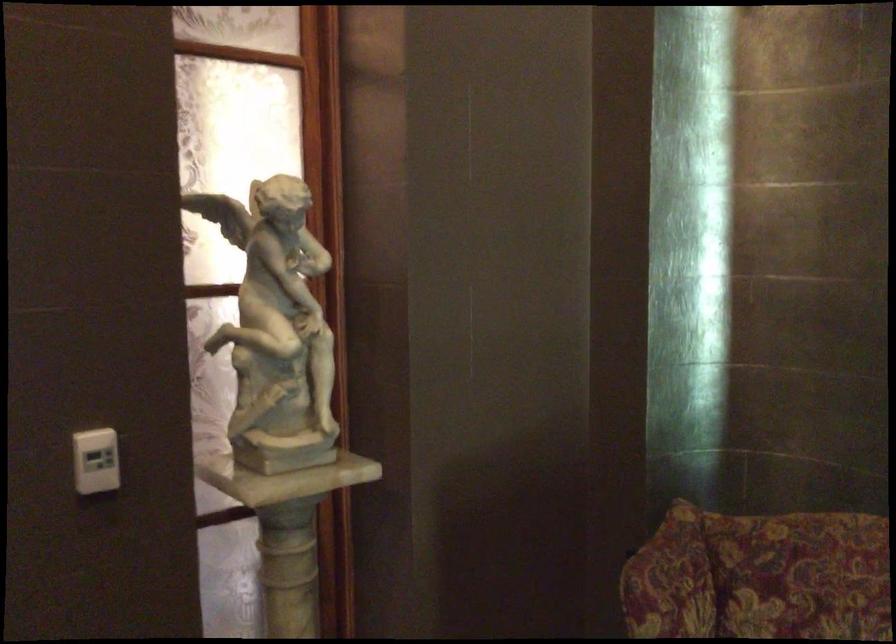
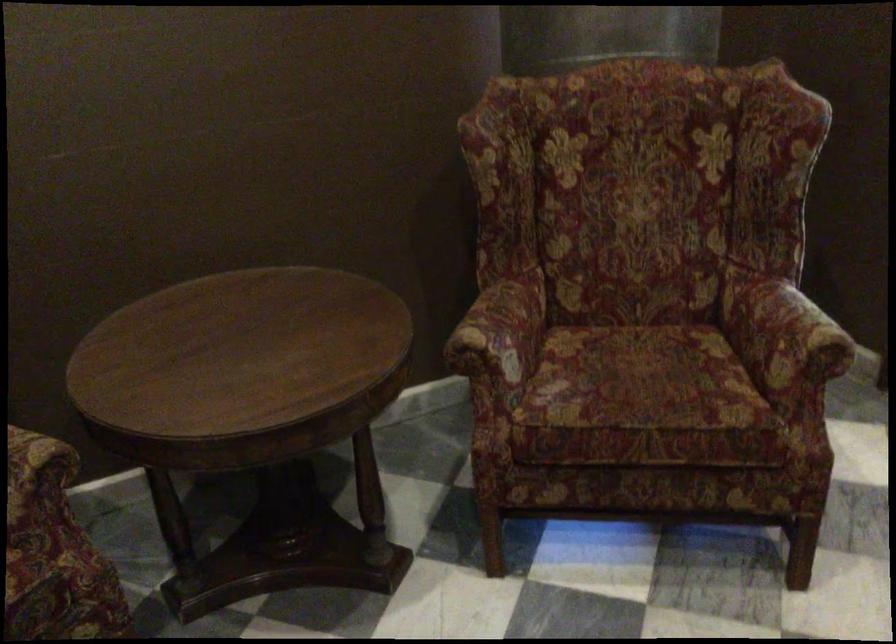
First-person continuous shooting, in which direction is the camera rotating?

The rotation direction of the camera is right-down.